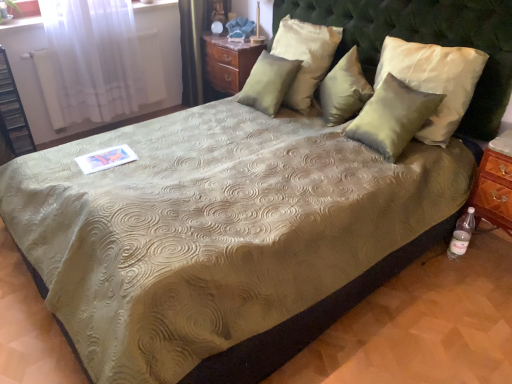
Question: From the image's perspective, is green tufted headboard at upper center positioned above or below satin white pillow at upper center, which is the 2th pillow in left-to-right order?

Choices:
 (A) below
 (B) above

Answer: (A)

Question: From their relative heights in the image, would you say green tufted headboard at upper center is taller or shorter than satin white pillow at upper center, which is the 2th pillow in left-to-right order?

Choices:
 (A) short
 (B) tall

Answer: (A)

Question: Which of these objects is positioned closest to the satin green pillow at upper center, the 4th pillow from the right?

Choices:
 (A) wooden nightstand at upper center
 (B) satin green pillow at center, positioned as the third pillow in left-to-right order
 (C) clear plastic bottle at lower right
 (D) black plastic shelf at left
 (E) white sheer curtain at upper left

Answer: (B)

Question: Considering the real-world distances, which object is closest to the green tufted headboard at upper center?

Choices:
 (A) satin green pillow at upper right, which is counted as the 4th pillow, starting from the left
 (B) wooden nightstand at upper center
 (C) satin green pillow at upper center, the 4th pillow from the right
 (D) black plastic shelf at left
 (E) white sheer curtain at upper left

Answer: (A)